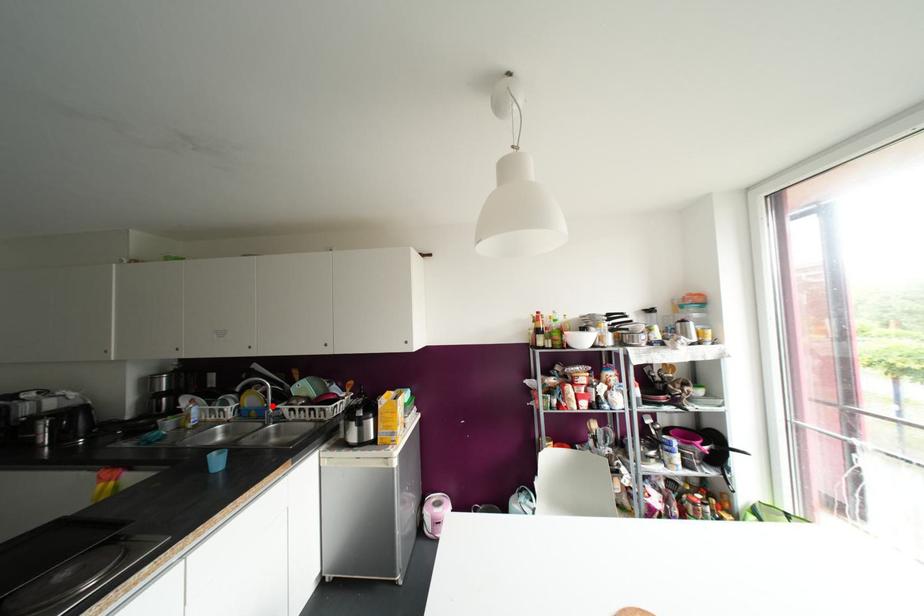
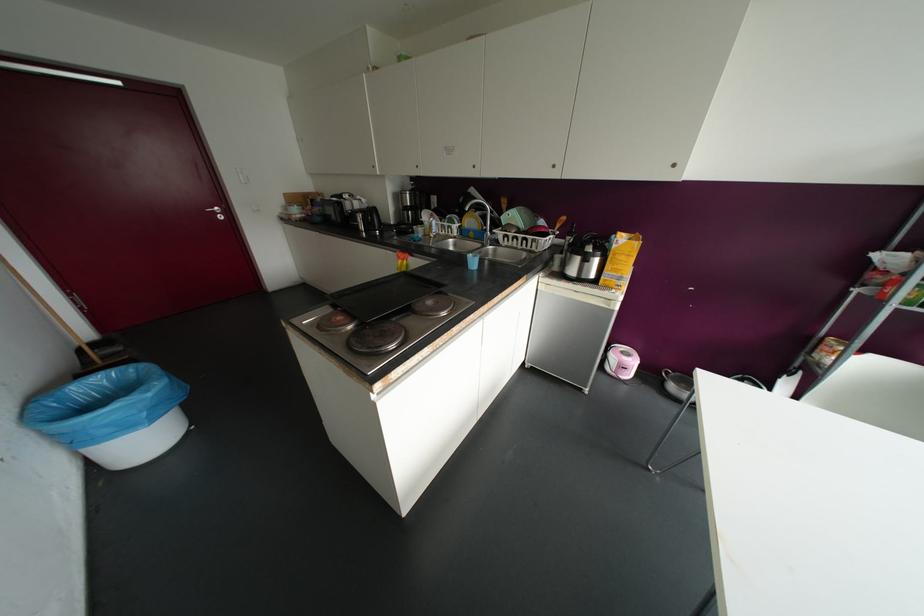
Find the pixel in the second image that matches the highlighted location in the first image.

(490, 230)